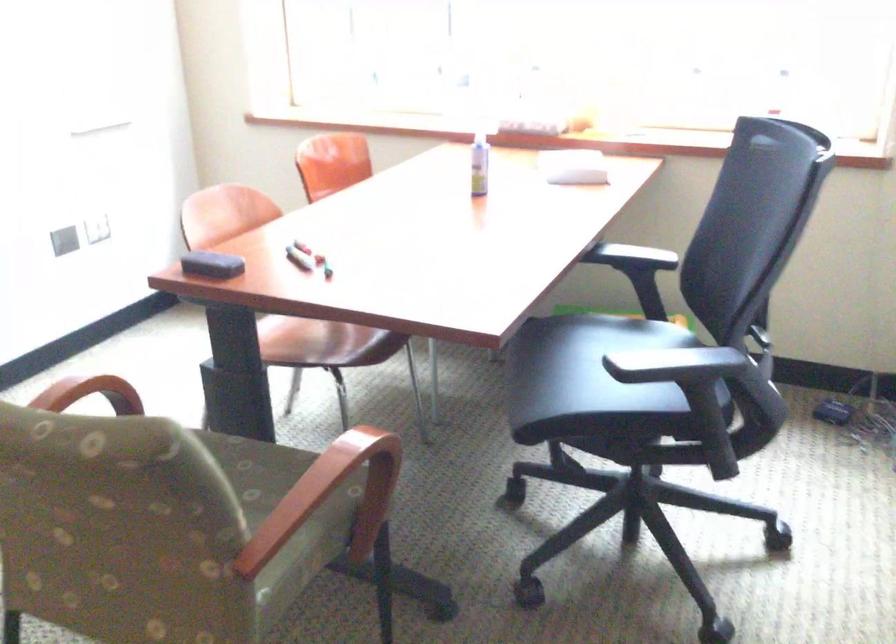
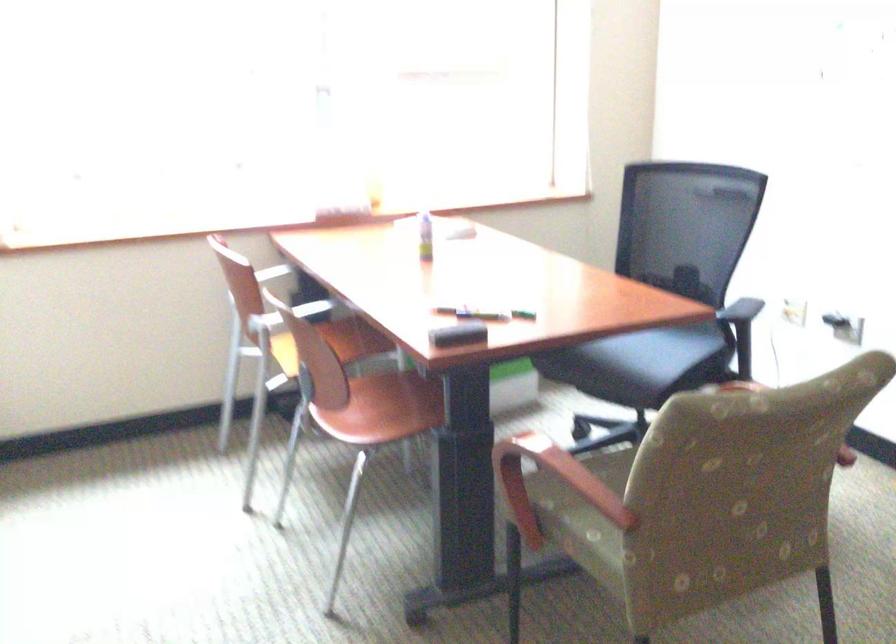
Where in the second image is the point corresponding to the point at 521,138 from the first image?

(346, 214)